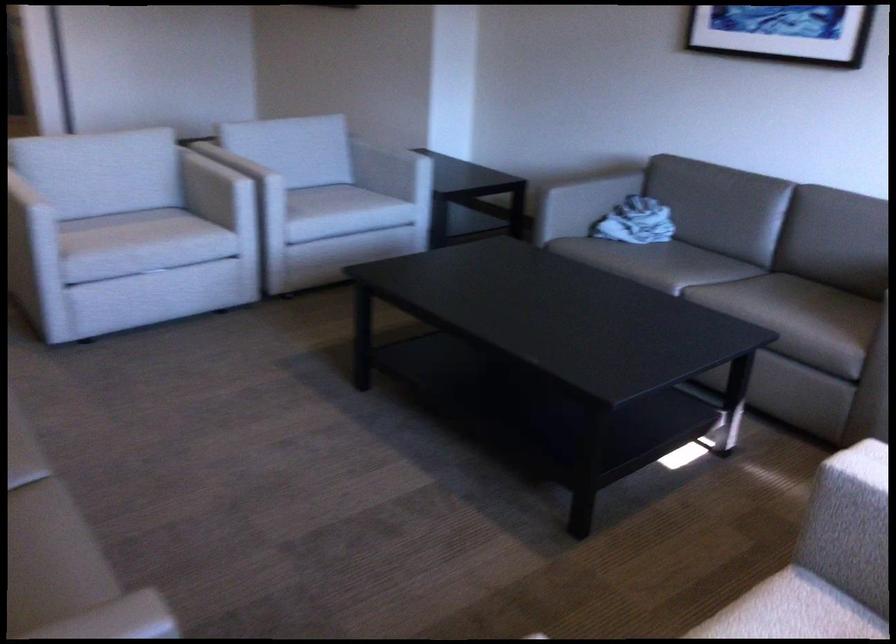
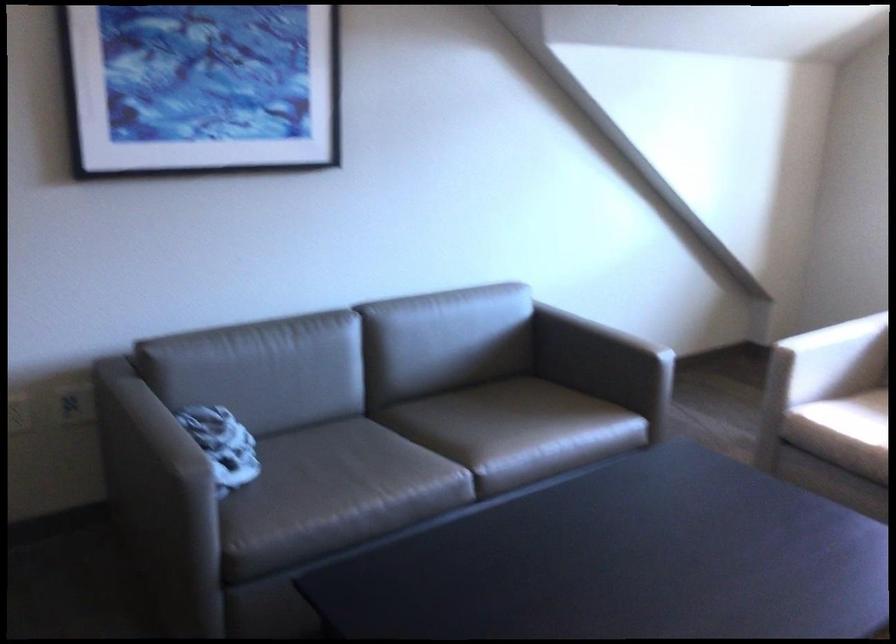
Locate, in the second image, the point that corresponds to pixel 757 298 in the first image.

(497, 430)